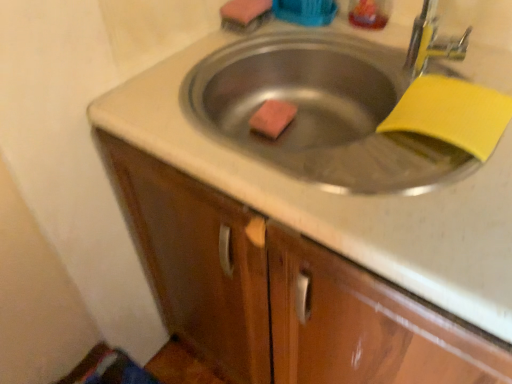
Question: Is pink sponge at upper center, the second soap positioned from the bottom, facing away from translucent plastic liquid at upper right?

Choices:
 (A) yes
 (B) no

Answer: (B)

Question: From a real-world perspective, is pink sponge at upper center, which appears as the first soap when viewed from the top, positioned over translucent plastic liquid at upper right based on gravity?

Choices:
 (A) yes
 (B) no

Answer: (B)

Question: Considering the relative sizes of pink sponge at upper center, which appears as the first soap when viewed from the top, and translucent plastic liquid at upper right in the image provided, is pink sponge at upper center, which appears as the first soap when viewed from the top, smaller than translucent plastic liquid at upper right?

Choices:
 (A) yes
 (B) no

Answer: (A)

Question: Is there a large distance between pink sponge at upper center, which appears as the first soap when viewed from the top, and translucent plastic liquid at upper right?

Choices:
 (A) yes
 (B) no

Answer: (B)

Question: Considering the relative sizes of pink sponge at upper center, which appears as the first soap when viewed from the top, and translucent plastic liquid at upper right in the image provided, is pink sponge at upper center, which appears as the first soap when viewed from the top, thinner than translucent plastic liquid at upper right?

Choices:
 (A) no
 (B) yes

Answer: (A)

Question: Is pink sponge at upper center, the second soap positioned from the bottom, positioned beyond the bounds of translucent plastic liquid at upper right?

Choices:
 (A) yes
 (B) no

Answer: (A)

Question: From the image's perspective, would you say pink sponge at upper center, the second soap positioned from the bottom, is positioned over pink sponge at center, which appears as the second soap when viewed from the top?

Choices:
 (A) yes
 (B) no

Answer: (A)

Question: From the image's perspective, is pink sponge at upper center, the second soap positioned from the bottom, located beneath pink sponge at center, arranged as the 1th soap when ordered from the bottom?

Choices:
 (A) yes
 (B) no

Answer: (B)

Question: From a real-world perspective, is pink sponge at upper center, the second soap positioned from the bottom, located beneath pink sponge at center, which appears as the second soap when viewed from the top?

Choices:
 (A) yes
 (B) no

Answer: (B)

Question: Is pink sponge at center, arranged as the 1th soap when ordered from the bottom, at the back of pink sponge at upper center, the second soap positioned from the bottom?

Choices:
 (A) no
 (B) yes

Answer: (A)

Question: Does pink sponge at upper center, the second soap positioned from the bottom, have a larger size compared to pink sponge at center, arranged as the 1th soap when ordered from the bottom?

Choices:
 (A) no
 (B) yes

Answer: (B)

Question: Is pink sponge at upper center, the second soap positioned from the bottom, directly adjacent to pink sponge at center, arranged as the 1th soap when ordered from the bottom?

Choices:
 (A) no
 (B) yes

Answer: (A)

Question: Considering the relative sizes of pink sponge at center, which appears as the second soap when viewed from the top, and translucent plastic liquid at upper right in the image provided, is pink sponge at center, which appears as the second soap when viewed from the top, smaller than translucent plastic liquid at upper right?

Choices:
 (A) no
 (B) yes

Answer: (B)